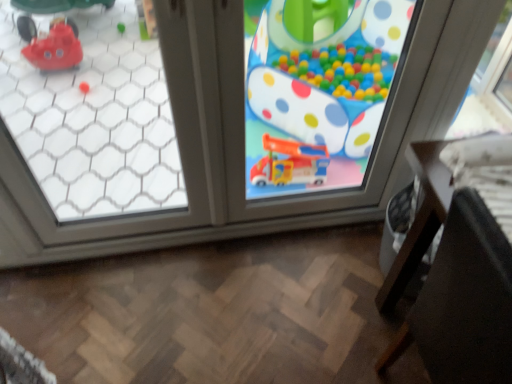
Question: Considering the positions of point (418, 309) and point (227, 129), is point (418, 309) closer or farther from the camera than point (227, 129)?

Choices:
 (A) closer
 (B) farther

Answer: (A)

Question: Choose the correct answer: Is black leather chair at lower right inside transparent glass window at center, the second window in the left-to-right sequence, or outside it?

Choices:
 (A) inside
 (B) outside

Answer: (B)

Question: Which object is positioned closest to the transparent glass window at upper left, placed as the 2th window when sorted from right to left?

Choices:
 (A) matte plastic toy at center
 (B) transparent glass window at center, the 1th window when ordered from right to left
 (C) black leather chair at lower right

Answer: (B)

Question: Estimate the real-world distances between objects in this image. Which object is farther from the black leather chair at lower right?

Choices:
 (A) transparent glass window at center, the 1th window when ordered from right to left
 (B) matte plastic toy at center
 (C) transparent glass window at upper left, placed as the 2th window when sorted from right to left

Answer: (C)